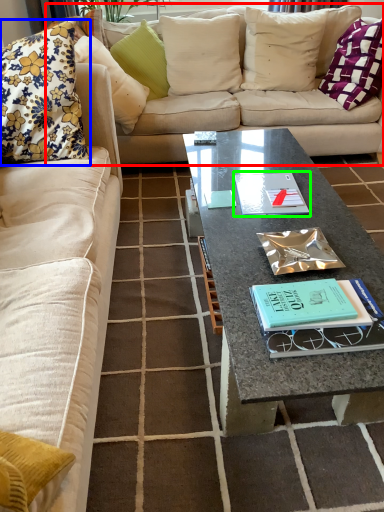
Question: Which object is positioned closest to studio couch (highlighted by a red box)? Select from pillow (highlighted by a blue box) and paperback book (highlighted by a green box).

Choices:
 (A) pillow
 (B) paperback book

Answer: (A)